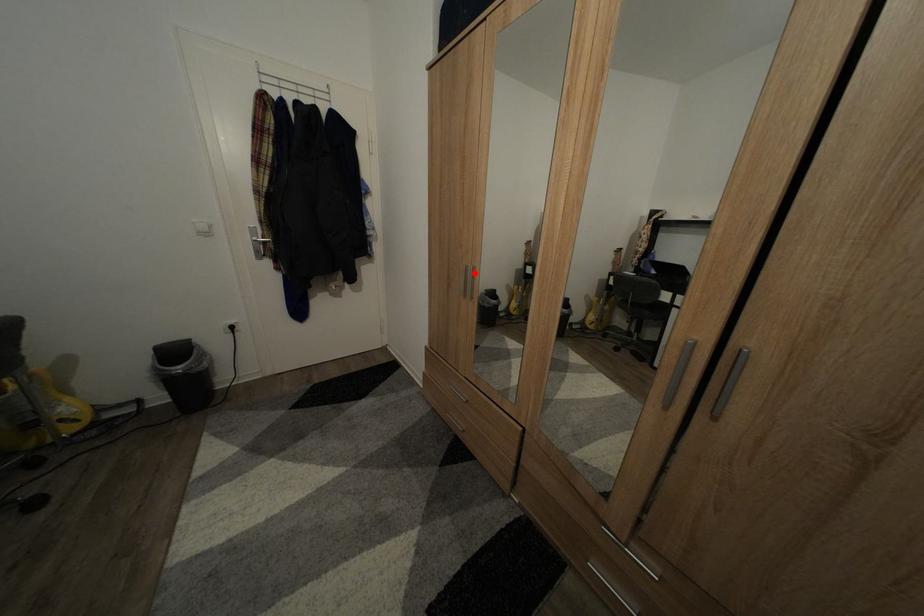
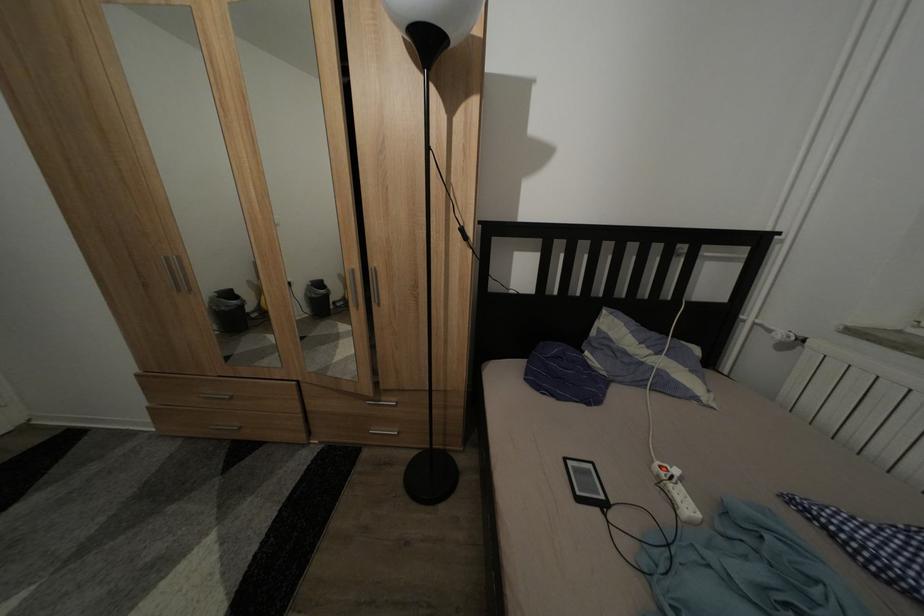
Find the pixel in the second image that matches the highlighted location in the first image.

(175, 265)